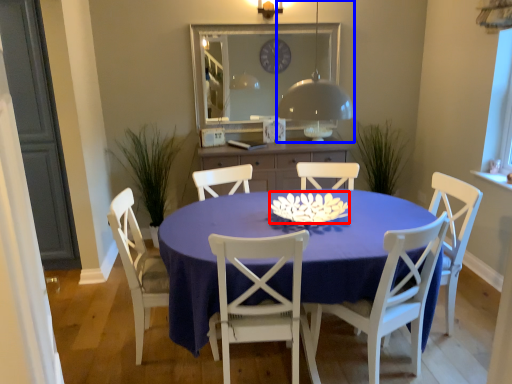
Question: Which point is further to the camera, flower (highlighted by a red box) or lamp (highlighted by a blue box)?

Choices:
 (A) flower
 (B) lamp

Answer: (A)